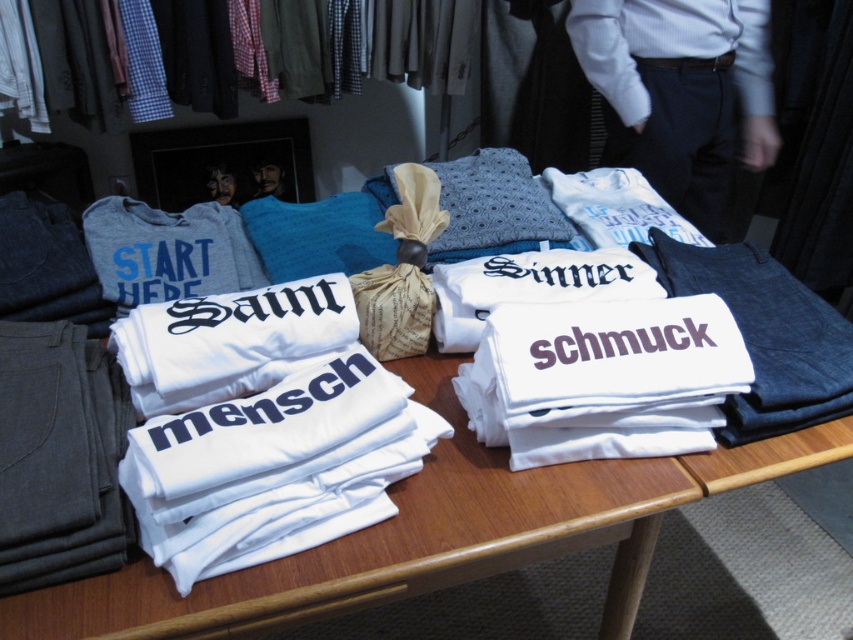
Question: Is white shirt at upper right positioned before burlap pillow at center?

Choices:
 (A) yes
 (B) no

Answer: (B)

Question: Is burlap pillow at center smaller than smooth skin face at upper center?

Choices:
 (A) yes
 (B) no

Answer: (B)

Question: Estimate the real-world distances between objects in this image. Which object is closer to the burlap pillow at center?

Choices:
 (A) smooth skin face at upper center
 (B) checkered fabric shirts at upper center

Answer: (B)

Question: Which object is the farthest from the checkered fabric shirts at upper center?

Choices:
 (A) smooth skin face at center
 (B) smooth skin face at upper center
 (C) burlap pillow at center

Answer: (C)

Question: Which point is farther to the camera?

Choices:
 (A) smooth skin face at upper center
 (B) checkered fabric shirts at upper center
 (C) burlap pillow at center
 (D) white shirt at upper right

Answer: (A)

Question: Does checkered fabric shirts at upper center appear over smooth skin face at center?

Choices:
 (A) no
 (B) yes

Answer: (B)